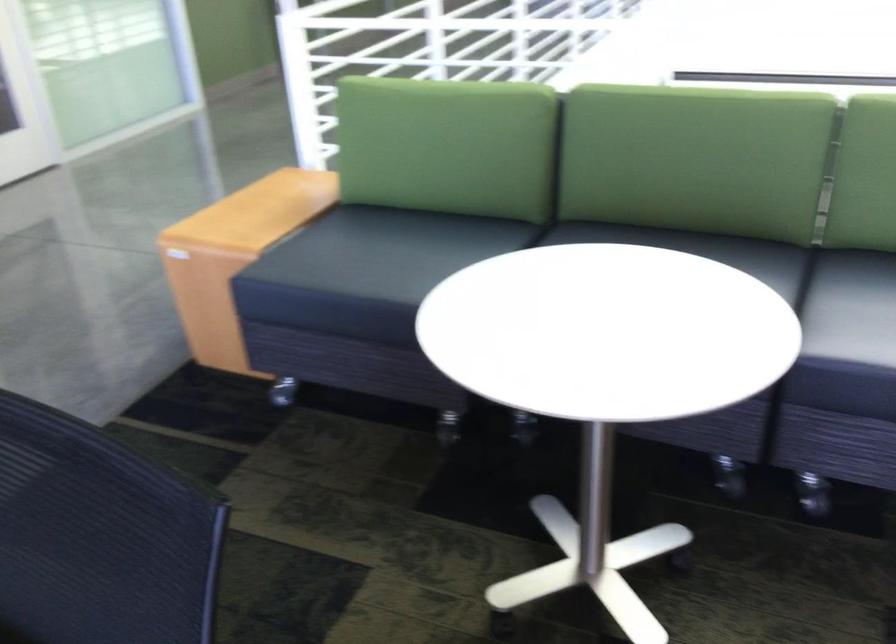
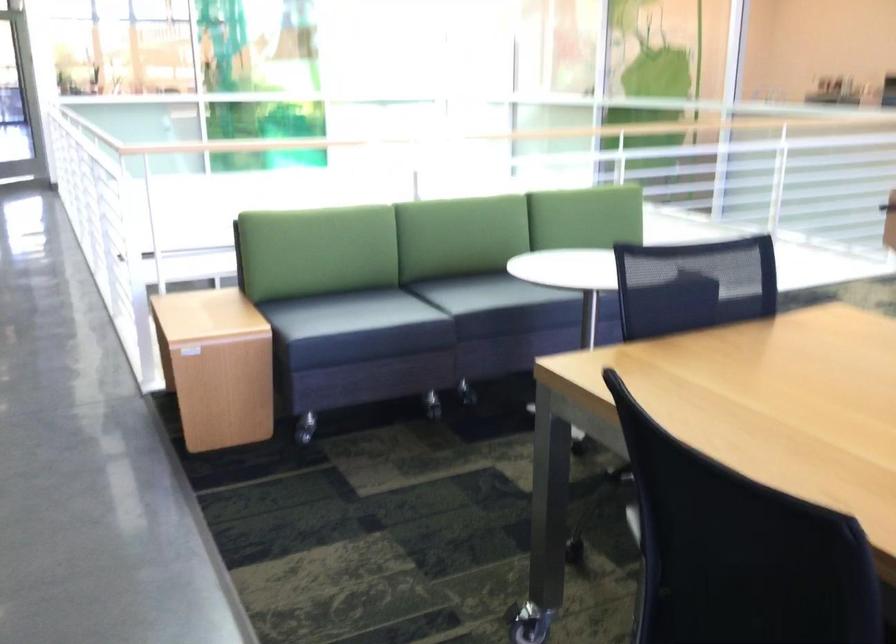
Where in the second image is the point corresponding to point (619, 474) from the first image?

(467, 393)